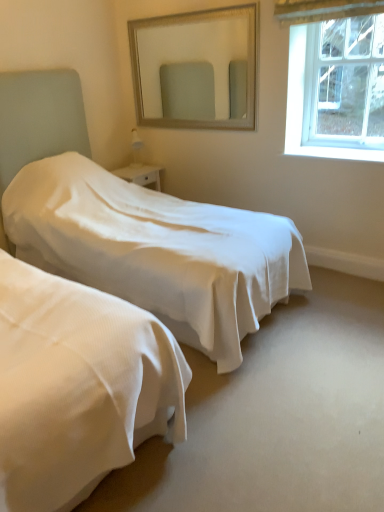
Question: Is white smooth bed at center at the left side of clear glass window at upper right?

Choices:
 (A) no
 (B) yes

Answer: (B)

Question: From a real-world perspective, does white smooth bed at center sit lower than clear glass window at upper right?

Choices:
 (A) yes
 (B) no

Answer: (A)

Question: Does white smooth bed at center lie behind clear glass window at upper right?

Choices:
 (A) yes
 (B) no

Answer: (B)

Question: Does white smooth bed at center come in front of clear glass window at upper right?

Choices:
 (A) yes
 (B) no

Answer: (A)

Question: Considering the relative sizes of white smooth bed at center and clear glass window at upper right in the image provided, is white smooth bed at center shorter than clear glass window at upper right?

Choices:
 (A) yes
 (B) no

Answer: (B)

Question: Considering the relative sizes of white smooth bed at center and clear glass window at upper right in the image provided, is white smooth bed at center taller than clear glass window at upper right?

Choices:
 (A) yes
 (B) no

Answer: (A)

Question: Does white smooth bed at center appear on the left side of silver textured mirror at upper center?

Choices:
 (A) no
 (B) yes

Answer: (B)

Question: Can you confirm if white smooth bed at center is positioned to the right of silver textured mirror at upper center?

Choices:
 (A) no
 (B) yes

Answer: (A)

Question: From a real-world perspective, is white smooth bed at center positioned over silver textured mirror at upper center based on gravity?

Choices:
 (A) yes
 (B) no

Answer: (B)

Question: Considering the relative sizes of white smooth bed at center and silver textured mirror at upper center in the image provided, is white smooth bed at center shorter than silver textured mirror at upper center?

Choices:
 (A) yes
 (B) no

Answer: (B)

Question: Does white smooth bed at center touch silver textured mirror at upper center?

Choices:
 (A) no
 (B) yes

Answer: (A)

Question: Does white smooth bed at center lie behind silver textured mirror at upper center?

Choices:
 (A) no
 (B) yes

Answer: (A)

Question: Is silver textured mirror at upper center touching clear glass window at upper right?

Choices:
 (A) no
 (B) yes

Answer: (A)